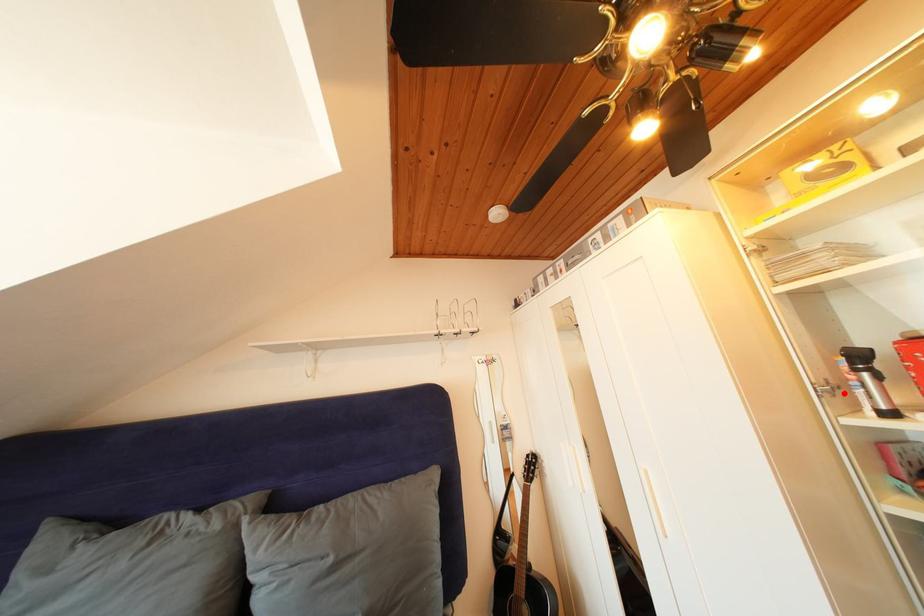
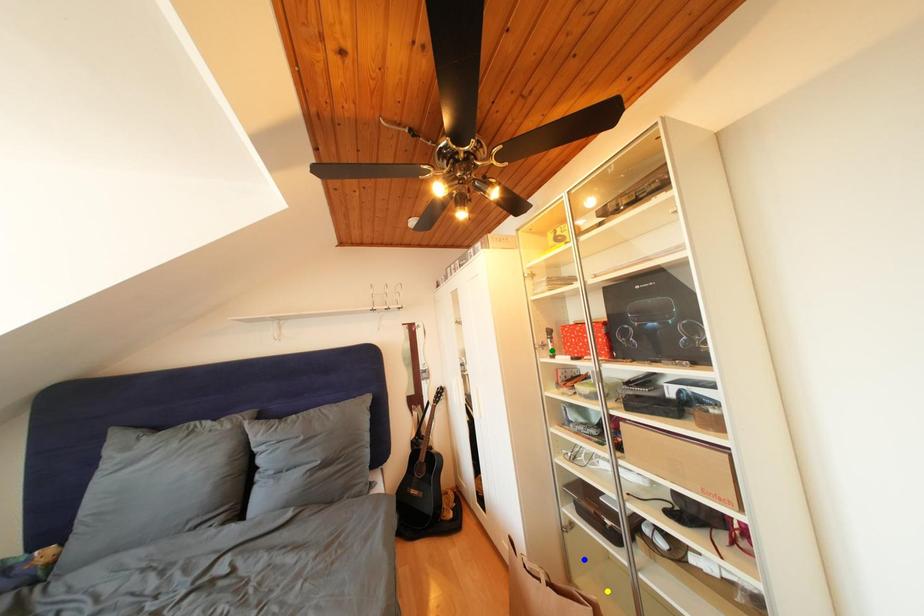
Question: I am providing you with two images of the same scene from different viewpoints. A red point is marked on the first image. You are given multiple points on the second image. In image 2, which mark is for the same physical point as the one in image 1?

Choices:
 (A) blue point
 (B) yellow point
 (C) green point

Answer: (C)